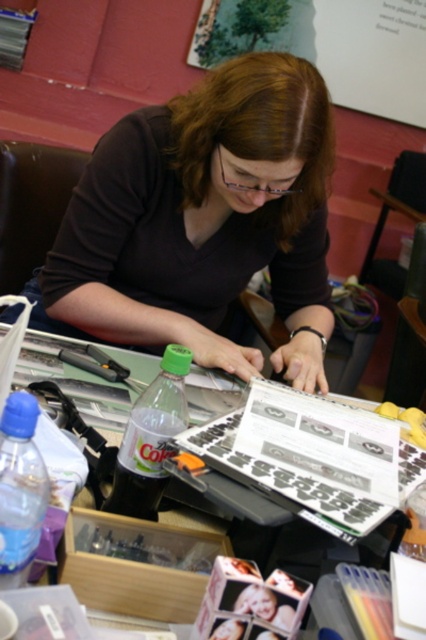
Does wooden bulletin board at upper center have a greater height compared to clear plastic table at center?

Yes.

Does wooden bulletin board at upper center appear on the left side of clear plastic table at center?

In fact, wooden bulletin board at upper center is to the right of clear plastic table at center.

Between point (224, 8) and point (310, 406), which one is positioned behind?

Point (224, 8)

You are a GUI agent. You are given a task and a screenshot of the screen. Output one action in this format:
    pyautogui.click(x=<x>, y=<y>)
    Task: Click on the wooden bulletin board at upper center
    The image size is (426, 640).
    Given the screenshot: What is the action you would take?
    pyautogui.click(x=362, y=51)

Is matte black shirt at center to the right of wooden bulletin board at upper center from the viewer's perspective?

Answer: In fact, matte black shirt at center is to the left of wooden bulletin board at upper center.

Is point (166, 211) in front of point (403, 36)?

Yes, it is in front of point (403, 36).

Identify the location of matte black shirt at center. The height and width of the screenshot is (640, 426). (203, 221).

Who is higher up, clear plastic table at center or blue plastic bottle at lower left?

blue plastic bottle at lower left is higher up.

Does clear plastic table at center appear over blue plastic bottle at lower left?

Incorrect, clear plastic table at center is not positioned above blue plastic bottle at lower left.

What are the coordinates of `clear plastic table at center` in the screenshot? It's located at (293, 436).